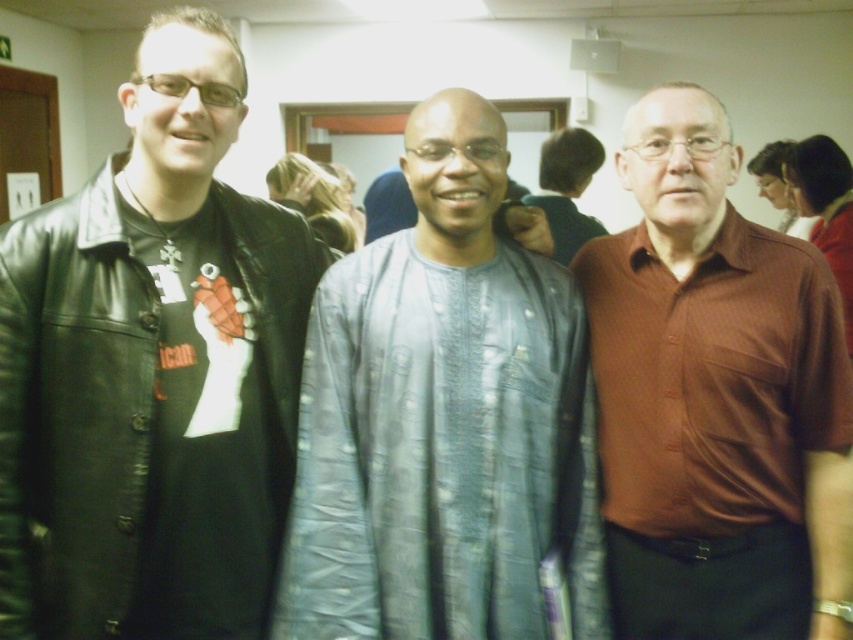
Based on the photo, what is located at the coordinates point (440, 419)?

The silvery textured fabric at center is located at point (440, 419).

You are standing in the room and want to locate the brown smooth shirt at center. According to the coordinates provided, where would you look to find it?

The brown smooth shirt at center is located at coordinates point (x=715, y=397).